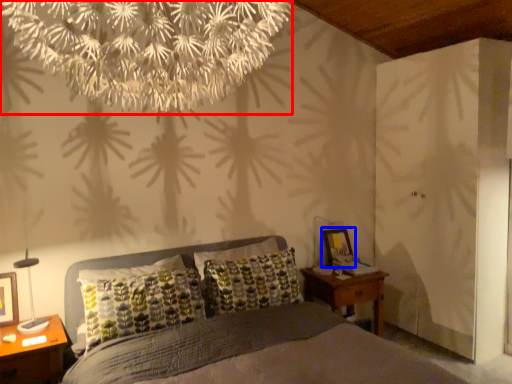
Question: Which of the following is the closest to the observer, flower (highlighted by a red box) or picture frame (highlighted by a blue box)?

Choices:
 (A) flower
 (B) picture frame

Answer: (A)